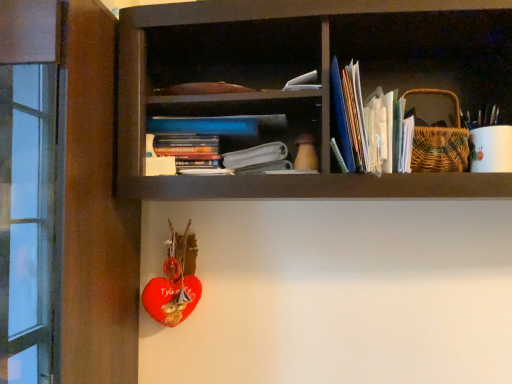
Question: Considering the positions of point (366, 135) and point (185, 160), is point (366, 135) closer or farther from the camera than point (185, 160)?

Choices:
 (A) farther
 (B) closer

Answer: (B)

Question: Considering the positions of white paper stack at upper right, placed as the second book when sorted from left to right, and hardcover book at center, the first book in the left-to-right sequence, in the image, is white paper stack at upper right, placed as the second book when sorted from left to right, taller or shorter than hardcover book at center, the first book in the left-to-right sequence,?

Choices:
 (A) short
 (B) tall

Answer: (B)

Question: Estimate the real-world distances between objects in this image. Which object is farther from the white paper at center?

Choices:
 (A) woven brown basket at upper right
 (B) white paper stack at upper right, the first book viewed from the right
 (C) hardcover book at center, the first book in the left-to-right sequence

Answer: (A)

Question: Considering the real-world distances, which object is closest to the white paper at center?

Choices:
 (A) hardcover book at center, the first book in the left-to-right sequence
 (B) white paper stack at upper right, placed as the second book when sorted from left to right
 (C) woven brown basket at upper right

Answer: (A)